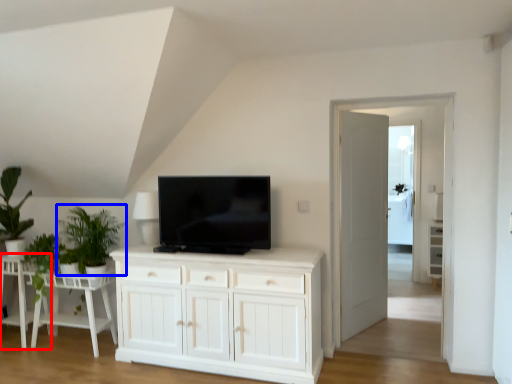
Question: Which point is further to the camera, table (highlighted by a red box) or plant (highlighted by a blue box)?

Choices:
 (A) table
 (B) plant

Answer: (A)